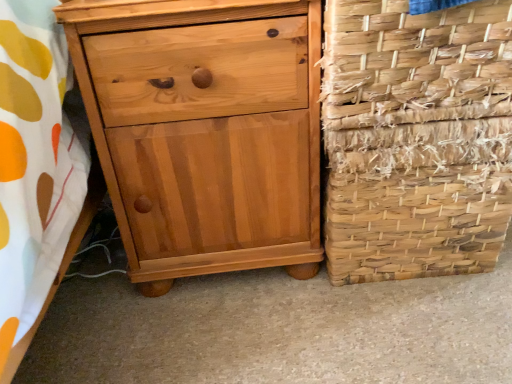
Question: From the image's perspective, does woven straw basket at right appear lower than woven natural fiber basket at right?

Choices:
 (A) no
 (B) yes

Answer: (A)

Question: Does woven straw basket at right come behind woven natural fiber basket at right?

Choices:
 (A) yes
 (B) no

Answer: (B)

Question: Considering the relative sizes of woven straw basket at right and woven natural fiber basket at right in the image provided, is woven straw basket at right taller than woven natural fiber basket at right?

Choices:
 (A) yes
 (B) no

Answer: (B)

Question: Is woven straw basket at right bigger than woven natural fiber basket at right?

Choices:
 (A) yes
 (B) no

Answer: (B)

Question: Is woven straw basket at right beside woven natural fiber basket at right?

Choices:
 (A) yes
 (B) no

Answer: (A)

Question: From the image's perspective, relative to woven natural fiber basket at right, is light brown wood chest of drawers at left above or below?

Choices:
 (A) above
 (B) below

Answer: (A)

Question: In terms of size, does light brown wood chest of drawers at left appear bigger or smaller than woven natural fiber basket at right?

Choices:
 (A) small
 (B) big

Answer: (B)

Question: In terms of width, does light brown wood chest of drawers at left look wider or thinner when compared to woven natural fiber basket at right?

Choices:
 (A) wide
 (B) thin

Answer: (A)

Question: Would you say light brown wood chest of drawers at left is inside or outside woven natural fiber basket at right?

Choices:
 (A) inside
 (B) outside

Answer: (B)

Question: Is point (403, 86) closer or farther from the camera than point (375, 135)?

Choices:
 (A) farther
 (B) closer

Answer: (B)

Question: From a real-world perspective, relative to woven natural fiber basket at right, is woven straw basket at right vertically above or below?

Choices:
 (A) below
 (B) above

Answer: (B)

Question: In the image, is woven straw basket at right positioned in front of or behind woven natural fiber basket at right?

Choices:
 (A) front
 (B) behind

Answer: (A)

Question: Is woven straw basket at right taller or shorter than woven natural fiber basket at right?

Choices:
 (A) tall
 (B) short

Answer: (B)

Question: Relative to light brown wood chest of drawers at left, is woven straw basket at right in front or behind?

Choices:
 (A) behind
 (B) front

Answer: (B)

Question: Is woven straw basket at right inside or outside of light brown wood chest of drawers at left?

Choices:
 (A) outside
 (B) inside

Answer: (A)